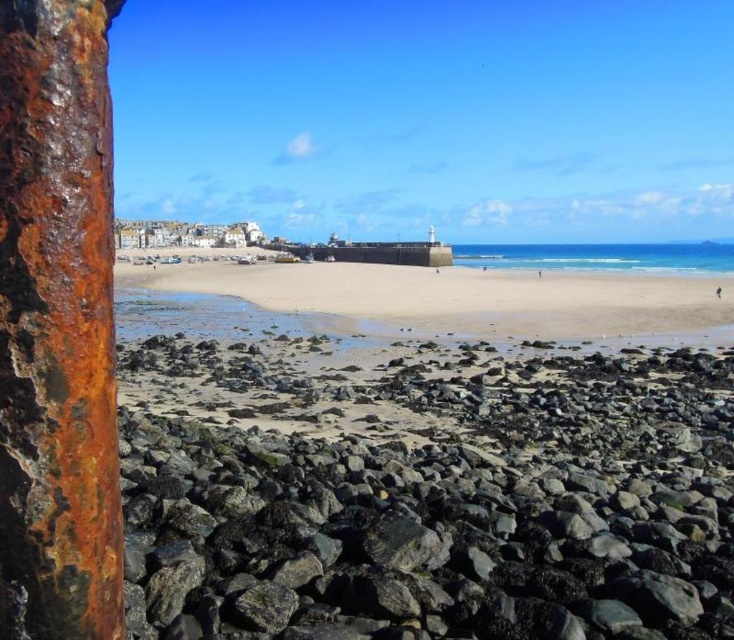
You are a photographer planning to capture the entire scene in one shot. Given that the rusty metal pole at left and the smooth sand at center are both in your frame, which object would you need to adjust your focus settings for to ensure it appears more detailed in the photo?

The rusty metal pole at left has a smaller size compared to smooth sand at center, so you should adjust your focus settings for the rusty metal pole at left to ensure its smaller details are captured clearly.

You are standing on the beach and see the rusty metal rocks at lower left and the blue glossy water at center. Which object is closer to your left side?

The rusty metal rocks at lower left is to the left of blue glossy water at center, so the rusty metal rocks at lower left is closer to your left side.

You are standing on the beach and want to place a small decorative item on the rusty metal rocks at lower left. Considering their size, will they have enough space to hold the item without it falling into the blue glossy water at center?

The rusty metal rocks at lower left are smaller than the blue glossy water at center. Since the rocks are smaller, there might not be enough space to securely place the item, so it could potentially fall into the water.